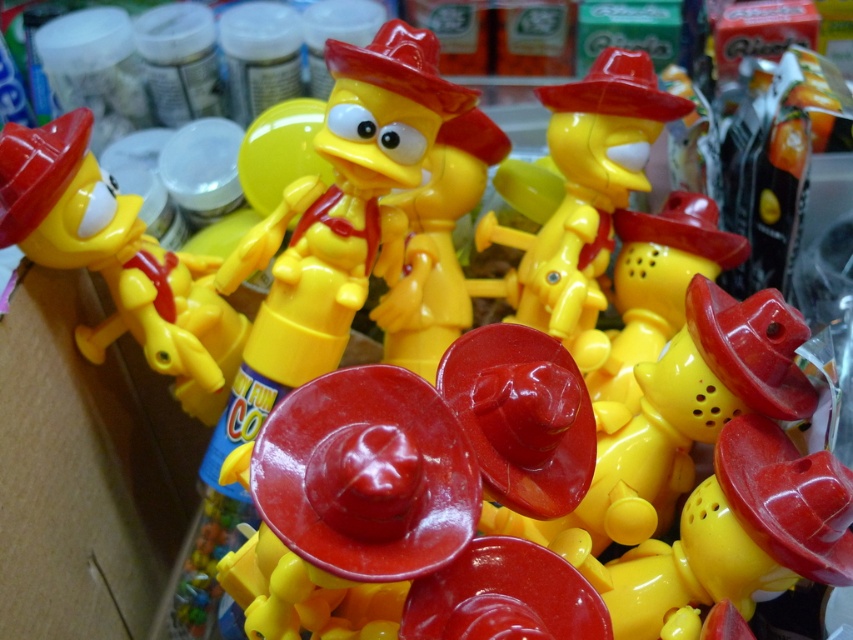
From the picture: You are a customer at a store and see the matte yellow toy at center displayed on a shelf. If your hand can reach up to 26 inches, can you grab it without needing a step stool?

The matte yellow toy at center is 27.22 inches away from the viewer, which is slightly beyond your hand reach of 26 inches. Therefore, you would need a step stool to grab it.

You are a customer looking at the toys in the store. You see the matte yellow toy at center and the matte plastic toy at center. Which one is positioned to the left?

The matte yellow toy at center is to the left of the matte plastic toy at center.

You are a customer at a toy store looking to buy a duck toy with a red sombrero. You see two options on the shelf, the matte yellow toy at center and the matte plastic toy at center. Which one is smaller?

The matte yellow toy at center is smaller than the matte plastic toy at center.